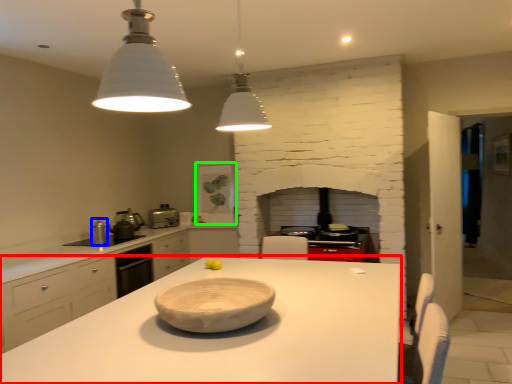
Question: Based on their relative distances, which object is nearer to countertop (highlighted by a red box)? Choose from appliance (highlighted by a blue box) and appliance (highlighted by a green box).

Choices:
 (A) appliance
 (B) appliance

Answer: (A)